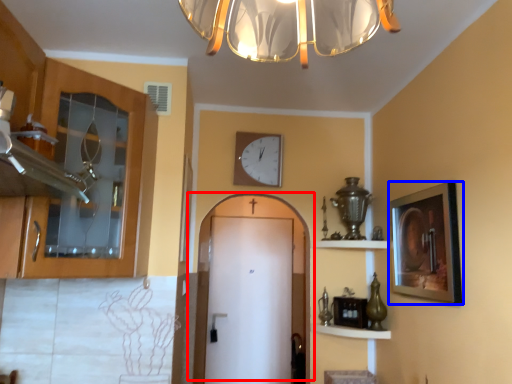
Question: Which point is further to the camera, door (highlighted by a red box) or picture frame (highlighted by a blue box)?

Choices:
 (A) door
 (B) picture frame

Answer: (A)